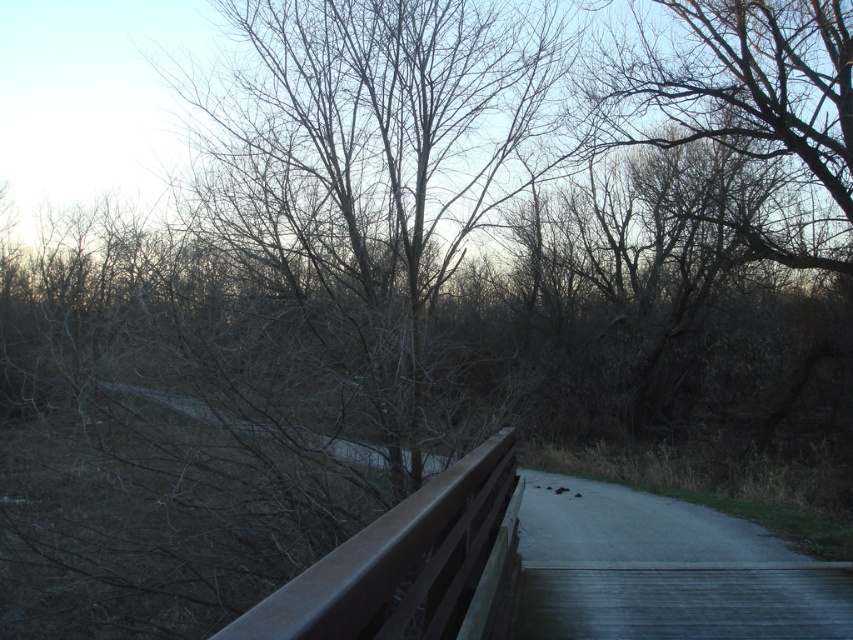
You are an artist sketching the scene and want to ensure the proportions are accurate. Based on the image, which object is narrower between the bare branches at center and the metallic brown railing at center?

The bare branches at center are narrower than the metallic brown railing at center.

In the scene shown: You are standing on the path and want to take a photo of the bare branches at center and the metallic brown railing at center. Which object will appear larger in the photo?

The bare branches at center will appear larger in the photo because they are much taller than the metallic brown railing at center.